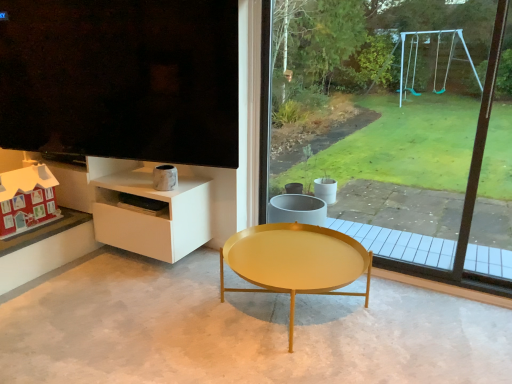
Question: From the image's perspective, is matte black screen at upper left located above or below gold metallic coffee table at center?

Choices:
 (A) below
 (B) above

Answer: (B)

Question: Choose the correct answer: Is matte black screen at upper left inside gold metallic coffee table at center or outside it?

Choices:
 (A) outside
 (B) inside

Answer: (A)

Question: Based on their relative distances, which object is nearer to the white glossy shelf at lower left?

Choices:
 (A) matte black screen at upper left
 (B) matte red wooden house at lower left
 (C) transparent glass window at center
 (D) gold metallic coffee table at center

Answer: (A)

Question: Which object is the farthest from the gold metallic coffee table at center?

Choices:
 (A) matte black screen at upper left
 (B) white glossy shelf at lower left
 (C) transparent glass window at center
 (D) matte red wooden house at lower left

Answer: (C)